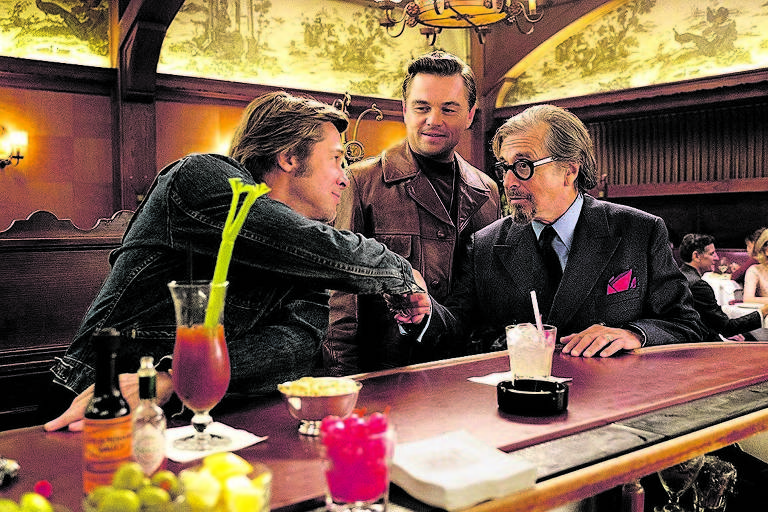
Where is `black ash tray`? This screenshot has height=512, width=768. black ash tray is located at coordinates (518, 394).